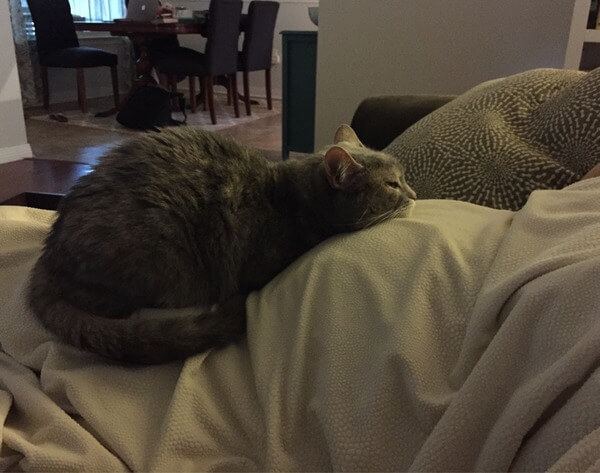
This screenshot has width=600, height=473. I want to click on table, so click(x=152, y=23).